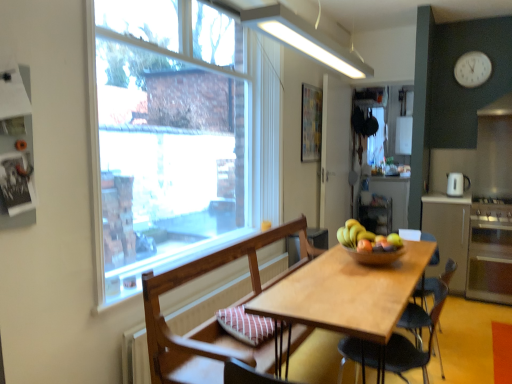
Question: From the image's perspective, would you say clear glass window at upper left is positioned over wooden chair at center, which is the 2th chair in front-to-back order?

Choices:
 (A) yes
 (B) no

Answer: (A)

Question: Considering the relative sizes of clear glass window at upper left and wooden chair at center, the first chair when ordered from back to front, in the image provided, is clear glass window at upper left shorter than wooden chair at center, the first chair when ordered from back to front,?

Choices:
 (A) no
 (B) yes

Answer: (A)

Question: Is clear glass window at upper left wider than wooden chair at center, which is the 2th chair in front-to-back order?

Choices:
 (A) yes
 (B) no

Answer: (B)

Question: Considering the relative positions of clear glass window at upper left and wooden chair at center, which is the 2th chair in front-to-back order, in the image provided, is clear glass window at upper left behind wooden chair at center, which is the 2th chair in front-to-back order,?

Choices:
 (A) no
 (B) yes

Answer: (B)

Question: From a real-world perspective, is clear glass window at upper left over wooden chair at center, the first chair when ordered from back to front?

Choices:
 (A) no
 (B) yes

Answer: (B)

Question: Is clear glass window at upper left with wooden chair at center, the first chair when ordered from back to front?

Choices:
 (A) yes
 (B) no

Answer: (B)

Question: From the image's perspective, would you say light brown wooden table at center is shown under satin silver oven at right?

Choices:
 (A) yes
 (B) no

Answer: (A)

Question: Can you confirm if light brown wooden table at center is bigger than satin silver oven at right?

Choices:
 (A) yes
 (B) no

Answer: (A)

Question: Is light brown wooden table at center looking in the opposite direction of satin silver oven at right?

Choices:
 (A) no
 (B) yes

Answer: (A)

Question: Considering the relative sizes of light brown wooden table at center and satin silver oven at right in the image provided, is light brown wooden table at center thinner than satin silver oven at right?

Choices:
 (A) no
 (B) yes

Answer: (A)

Question: Considering the relative sizes of light brown wooden table at center and satin silver oven at right in the image provided, is light brown wooden table at center smaller than satin silver oven at right?

Choices:
 (A) yes
 (B) no

Answer: (B)

Question: Is light brown wooden table at center aimed at satin silver oven at right?

Choices:
 (A) yes
 (B) no

Answer: (B)

Question: Is clear glass window at upper left in front of white glossy refrigerator at upper right?

Choices:
 (A) no
 (B) yes

Answer: (B)